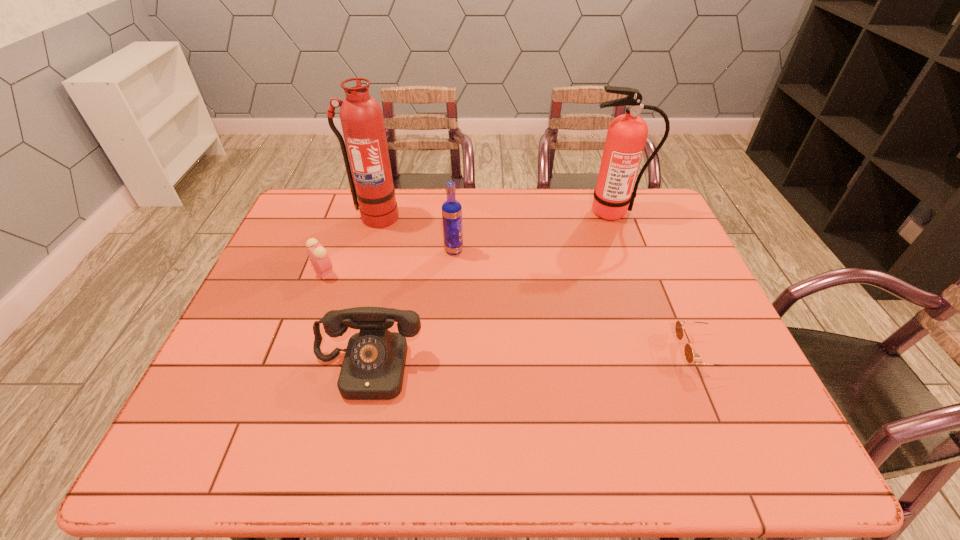
Where is `free region at the far edge`? free region at the far edge is located at coordinates (434, 192).

In the image, there is a desktop. Where is `vacant area at the near edge`? vacant area at the near edge is located at coordinates (437, 468).

You are a GUI agent. You are given a task and a screenshot of the screen. Output one action in this format:
    pyautogui.click(x=<x>, y=<y>)
    Task: Click on the free region at the left edge
    
    Given the screenshot: What is the action you would take?
    pyautogui.click(x=300, y=304)

Locate an element on the screen. vacant region at the right edge of the desktop is located at coordinates (671, 235).

Image resolution: width=960 pixels, height=540 pixels. I want to click on vacant area at the far left corner of the desktop, so click(x=300, y=207).

Where is `vacant area at the near left corner of the desktop`? vacant area at the near left corner of the desktop is located at coordinates (219, 436).

Find the location of a particular element. Image resolution: width=960 pixels, height=540 pixels. empty space that is in between the telephone and the third object from right to left is located at coordinates (411, 309).

Where is `unoccupied position between the alarm clock and the sunglasses`? This screenshot has height=540, width=960. unoccupied position between the alarm clock and the sunglasses is located at coordinates (513, 312).

The image size is (960, 540). I want to click on empty location between the shortest object and the left fire extinguisher, so click(x=539, y=285).

Locate an element on the screen. The height and width of the screenshot is (540, 960). free space between the left fire extinguisher and the vodka is located at coordinates (415, 234).